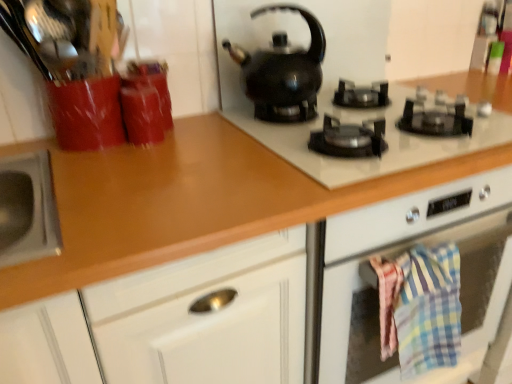
Question: Does black glossy gas stove at upper center have a smaller size compared to brown glossy countertop at center?

Choices:
 (A) yes
 (B) no

Answer: (A)

Question: Is black glossy gas stove at upper center further to camera compared to brown glossy countertop at center?

Choices:
 (A) yes
 (B) no

Answer: (A)

Question: Would you say black glossy gas stove at upper center is outside brown glossy countertop at center?

Choices:
 (A) yes
 (B) no

Answer: (A)

Question: From the image's perspective, is black glossy gas stove at upper center above brown glossy countertop at center?

Choices:
 (A) no
 (B) yes

Answer: (B)

Question: Can you confirm if black glossy gas stove at upper center is positioned to the left of brown glossy countertop at center?

Choices:
 (A) no
 (B) yes

Answer: (A)

Question: Is brown glossy countertop at center wider or thinner than black glossy gas stove at upper center?

Choices:
 (A) thin
 (B) wide

Answer: (B)

Question: Is brown glossy countertop at center to the left or to the right of black glossy gas stove at upper center in the image?

Choices:
 (A) right
 (B) left

Answer: (B)

Question: Considering the positions of brown glossy countertop at center and black glossy gas stove at upper center in the image, is brown glossy countertop at center bigger or smaller than black glossy gas stove at upper center?

Choices:
 (A) big
 (B) small

Answer: (A)

Question: From a real-world perspective, relative to black glossy gas stove at upper center, is brown glossy countertop at center vertically above or below?

Choices:
 (A) below
 (B) above

Answer: (A)

Question: Is plaid cotton towel at lower right wider or thinner than black glossy gas stove at upper center?

Choices:
 (A) thin
 (B) wide

Answer: (A)

Question: Relative to black glossy gas stove at upper center, is plaid cotton towel at lower right in front or behind?

Choices:
 (A) behind
 (B) front

Answer: (A)

Question: Is plaid cotton towel at lower right to the left or to the right of black glossy gas stove at upper center in the image?

Choices:
 (A) left
 (B) right

Answer: (B)

Question: Considering the positions of plaid cotton towel at lower right and black glossy gas stove at upper center in the image, is plaid cotton towel at lower right bigger or smaller than black glossy gas stove at upper center?

Choices:
 (A) small
 (B) big

Answer: (A)

Question: From their relative heights in the image, would you say black glossy kettle at upper center is taller or shorter than brown glossy countertop at center?

Choices:
 (A) short
 (B) tall

Answer: (A)

Question: Based on their positions, is black glossy kettle at upper center located to the left or right of brown glossy countertop at center?

Choices:
 (A) right
 (B) left

Answer: (A)